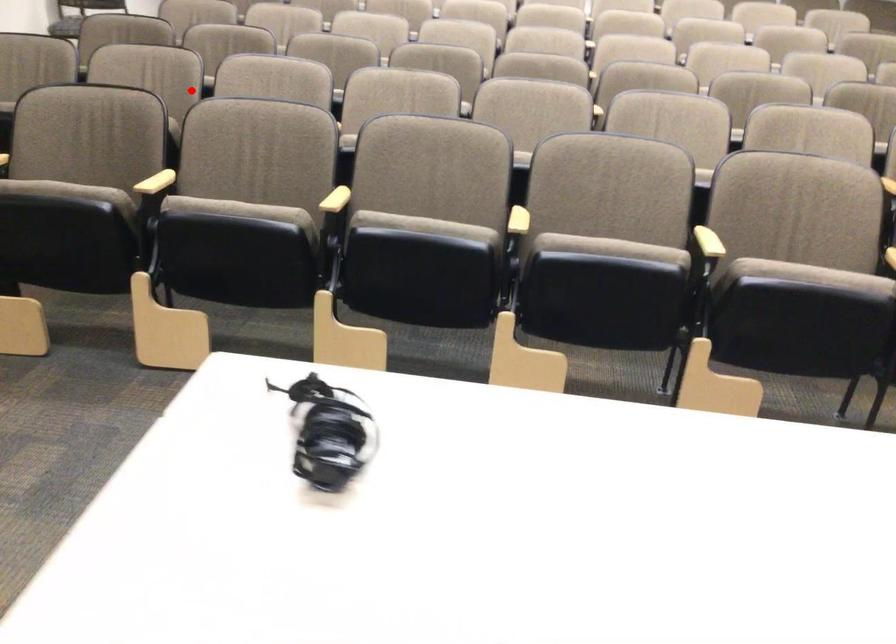
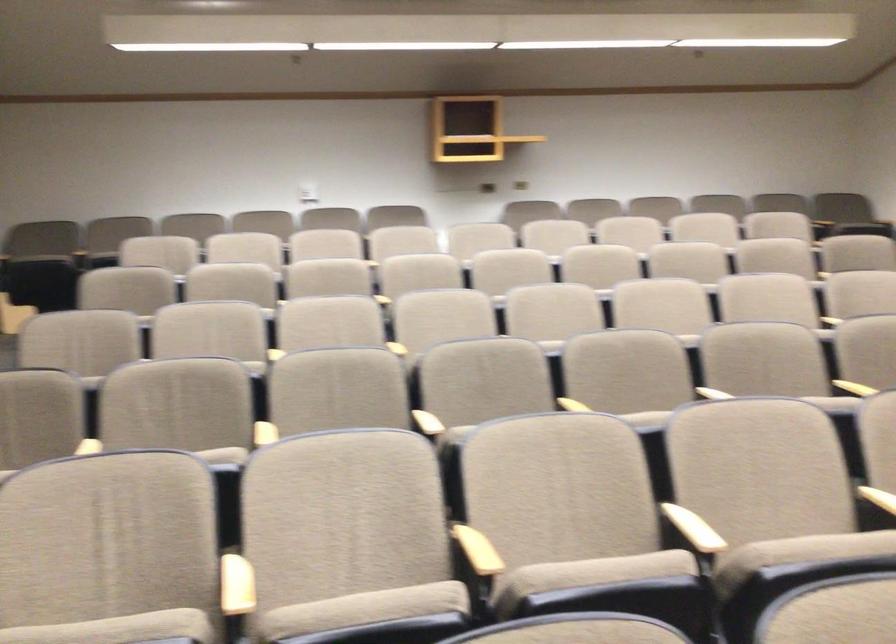
In the second image, find the point that corresponds to the highlighted location in the first image.

(236, 585)